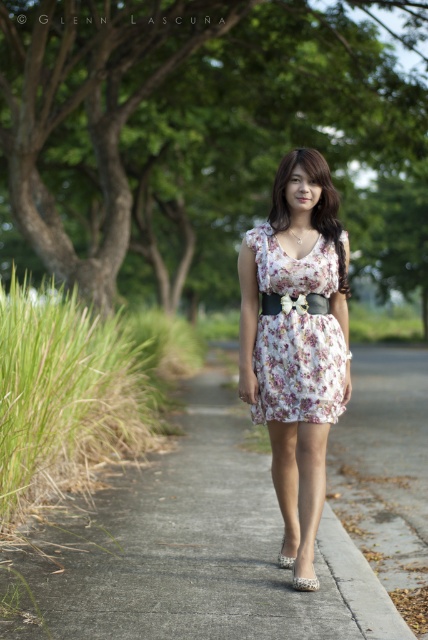
You are a photographer trying to capture the floral fabric dress at center. You notice a point at coordinates (x=296, y=339) in your camera viewfinder. Based on the scene, is this point likely part of the dress?

Yes, the point (x=296, y=339) is on the floral fabric dress at center, so it is part of the dress.

You are standing at the edge of the pathway and want to take a photo of the floral fabric dress at center. If your camera has a maximum focus range of 20 feet, will you be able to capture the dress clearly?

The floral fabric dress at center is 19.57 feet from viewer, which is within the camera maximum focus range of 20 feet. So yes, you can capture the dress clearly.